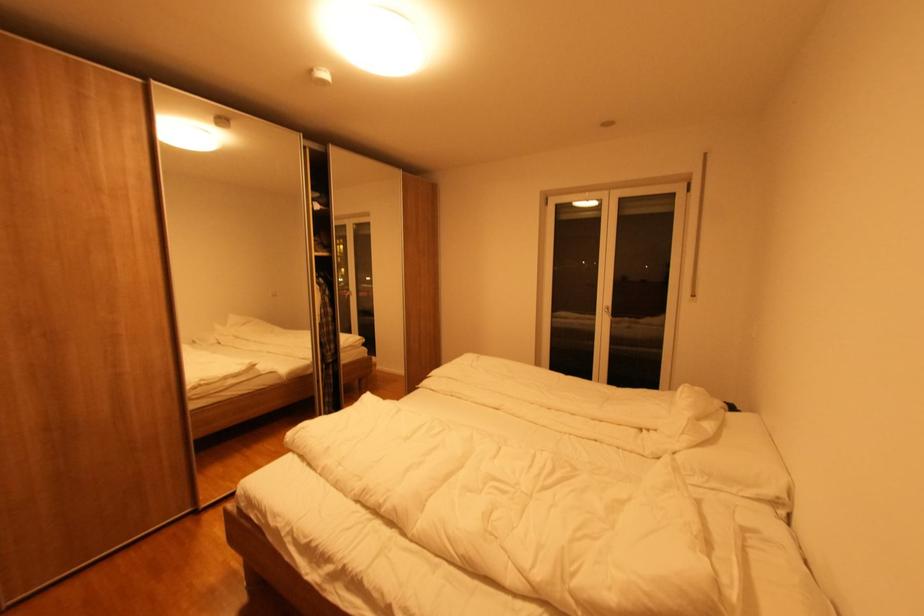
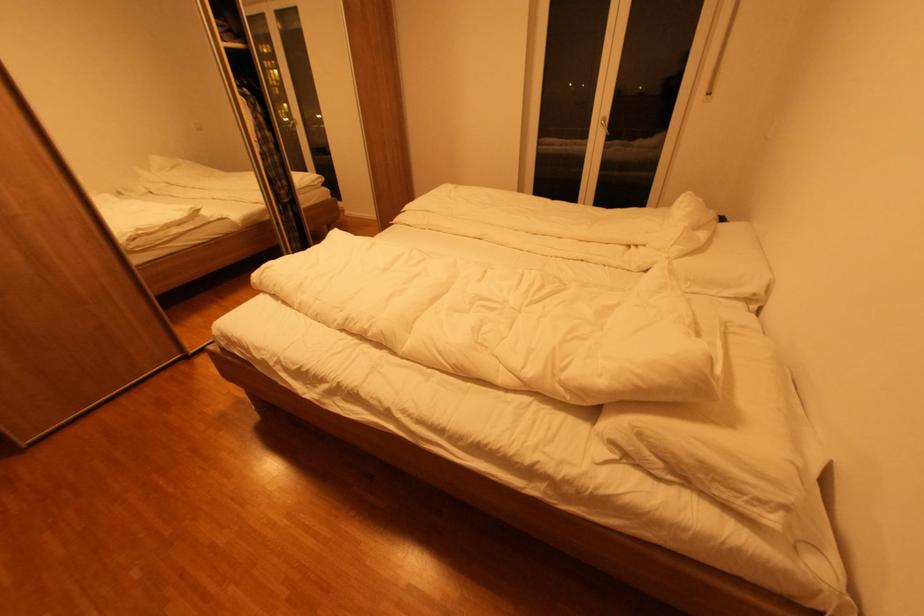
Locate, in the second image, the point that corresponds to pixel 707 446 in the first image.

(697, 254)